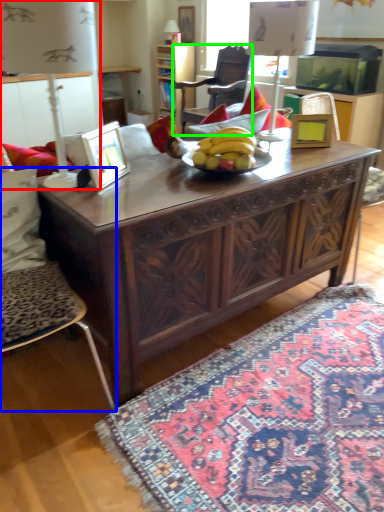
Question: Considering the real-world distances, which object is closest to lamp (highlighted by a red box)? chair (highlighted by a blue box) or chair (highlighted by a green box).

Choices:
 (A) chair
 (B) chair

Answer: (A)